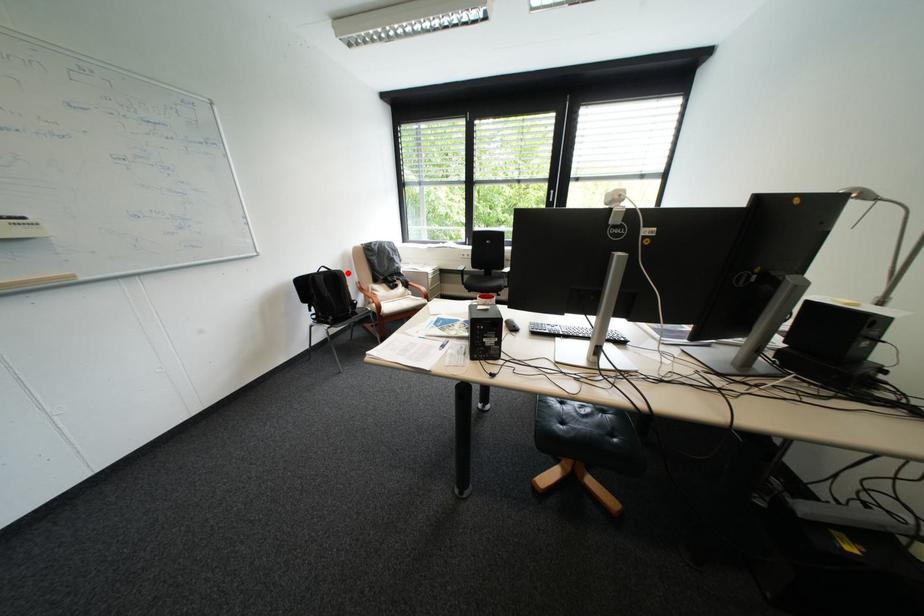
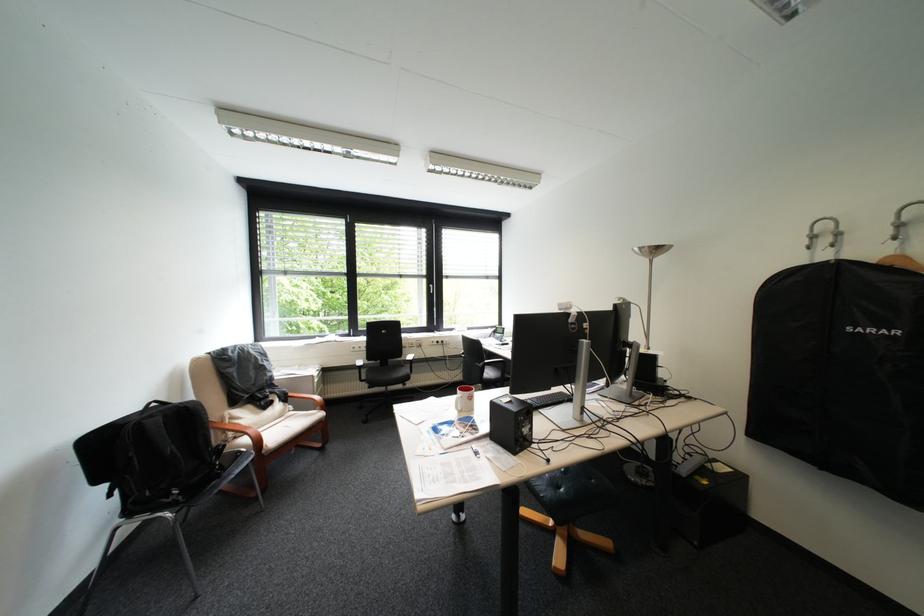
Question: I am providing you with two images of the same scene from different viewpoints. In image1, a red point is highlighted. Considering the same 3D point in image2, which of the following is correct?

Choices:
 (A) It is closer
 (B) It is farther

Answer: (B)